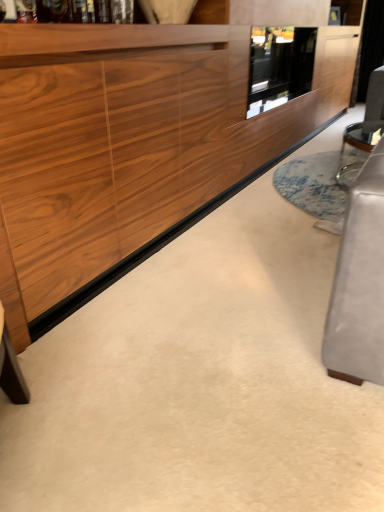
You are a GUI agent. You are given a task and a screenshot of the screen. Output one action in this format:
    pyautogui.click(x=<x>, y=<y>)
    Task: Click on the wooden cabinet at center
    The height and width of the screenshot is (512, 384).
    Given the screenshot: What is the action you would take?
    pyautogui.click(x=136, y=136)

Describe the element at coordinates (136, 136) in the screenshot. The image size is (384, 512). I see `wooden cabinet at center` at that location.

What is the approximate width of transparent glass door at upper center?

transparent glass door at upper center is 46.59 centimeters wide.

Based on the photo, measure the distance between transparent glass door at upper center and camera.

transparent glass door at upper center and camera are 2.66 meters apart.

Locate an element on the screen. transparent glass door at upper center is located at coordinates (279, 66).

What do you see at coordinates (279, 66) in the screenshot? I see `transparent glass door at upper center` at bounding box center [279, 66].

Where is `wooden cabinet at center`? wooden cabinet at center is located at coordinates (136, 136).

Considering the positions of objects wooden cabinet at center and transparent glass door at upper center in the image provided, who is more to the left, wooden cabinet at center or transparent glass door at upper center?

wooden cabinet at center is more to the left.

Which object is further away from the camera taking this photo, wooden cabinet at center or transparent glass door at upper center?

transparent glass door at upper center is more distant.

Is point (194, 205) in front of point (251, 73)?

Yes, point (194, 205) is in front of point (251, 73).

From the image's perspective, which object appears higher, wooden cabinet at center or transparent glass door at upper center?

transparent glass door at upper center is shown above in the image.

From a real-world perspective, is wooden cabinet at center positioned above or below transparent glass door at upper center?

Clearly, from a real-world perspective, wooden cabinet at center is below transparent glass door at upper center.

Which of these two, wooden cabinet at center or transparent glass door at upper center, is thinner?

Thinner between the two is transparent glass door at upper center.

Considering the sizes of objects wooden cabinet at center and transparent glass door at upper center in the image provided, who is taller, wooden cabinet at center or transparent glass door at upper center?

wooden cabinet at center is taller.

Consider the image. Considering the relative sizes of wooden cabinet at center and transparent glass door at upper center in the image provided, is wooden cabinet at center smaller than transparent glass door at upper center?

Actually, wooden cabinet at center might be larger than transparent glass door at upper center.

Is wooden cabinet at center inside the boundaries of transparent glass door at upper center, or outside?

wooden cabinet at center is not enclosed by transparent glass door at upper center.

Is wooden cabinet at center with transparent glass door at upper center?

There is a gap between wooden cabinet at center and transparent glass door at upper center.

Could you tell me if wooden cabinet at center is facing transparent glass door at upper center?

Yes, wooden cabinet at center is turned towards transparent glass door at upper center.

How many degrees apart are the facing directions of wooden cabinet at center and transparent glass door at upper center?

The angular difference between wooden cabinet at center and transparent glass door at upper center is 0.457 degrees.

At what (x,y) coordinates should I click in order to perform the action: click on cabinetry in front of the transparent glass door at upper center. Please return your answer as a coordinate pair (x, y). Looking at the image, I should click on (136, 136).

Is transparent glass door at upper center to the left or to the right of wooden cabinet at center in the image?

transparent glass door at upper center is to the right of wooden cabinet at center.

Considering the positions of objects transparent glass door at upper center and wooden cabinet at center in the image provided, who is in front, transparent glass door at upper center or wooden cabinet at center?

wooden cabinet at center is closer to the camera.

Between point (265, 50) and point (54, 157), which one is positioned in front?

The point (54, 157) is in front.

From the image's perspective, is transparent glass door at upper center above or below wooden cabinet at center?

Clearly, from the image's perspective, transparent glass door at upper center is above wooden cabinet at center.

From a real-world perspective, between transparent glass door at upper center and wooden cabinet at center, who is vertically lower?

wooden cabinet at center.

Between transparent glass door at upper center and wooden cabinet at center, which one has smaller width?

transparent glass door at upper center is thinner.

Can you confirm if transparent glass door at upper center is shorter than wooden cabinet at center?

Indeed, transparent glass door at upper center has a lesser height compared to wooden cabinet at center.

Which of these two, transparent glass door at upper center or wooden cabinet at center, is smaller?

With smaller size is transparent glass door at upper center.

Is transparent glass door at upper center inside or outside of wooden cabinet at center?

transparent glass door at upper center exists entirely within wooden cabinet at center.

Is transparent glass door at upper center next to wooden cabinet at center and touching it?

transparent glass door at upper center and wooden cabinet at center are clearly separated.

Is transparent glass door at upper center looking in the opposite direction of wooden cabinet at center?

Absolutely, transparent glass door at upper center is directed away from wooden cabinet at center.

How different are the orientations of transparent glass door at upper center and wooden cabinet at center in degrees?

The facing directions of transparent glass door at upper center and wooden cabinet at center are 0.457 degrees apart.

You are a GUI agent. You are given a task and a screenshot of the screen. Output one action in this format:
    pyautogui.click(x=<x>, y=<y>)
    Task: Click on the cabinetry in front of the transparent glass door at upper center
    The image size is (384, 512).
    Given the screenshot: What is the action you would take?
    pyautogui.click(x=136, y=136)

Locate an element on the screen. The width and height of the screenshot is (384, 512). glass door above the wooden cabinet at center (from the image's perspective) is located at coordinates (279, 66).

You are a GUI agent. You are given a task and a screenshot of the screen. Output one action in this format:
    pyautogui.click(x=<x>, y=<y>)
    Task: Click on the cabinetry below the transparent glass door at upper center (from the image's perspective)
    The width and height of the screenshot is (384, 512).
    Given the screenshot: What is the action you would take?
    pyautogui.click(x=136, y=136)